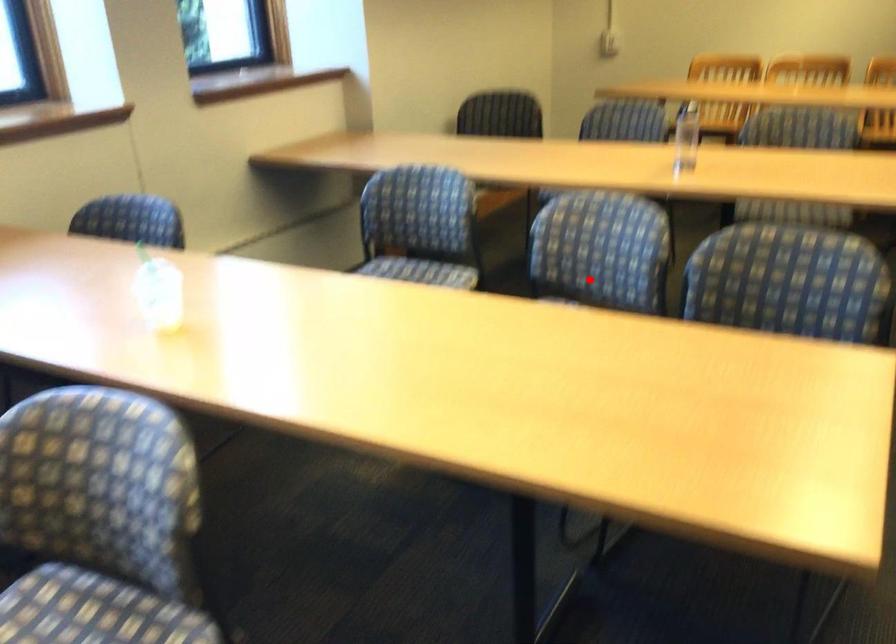
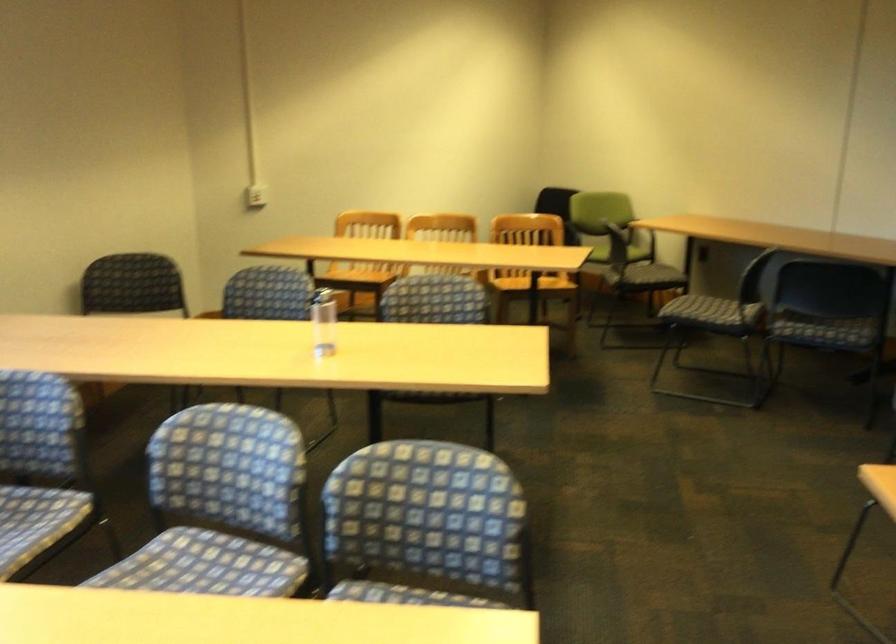
Question: I am providing you with two images of the same scene from different viewpoints. A red point is marked on the first image. At the location where the point appears in image 1, is it still visible in image 2?

Choices:
 (A) Yes
 (B) No

Answer: (A)